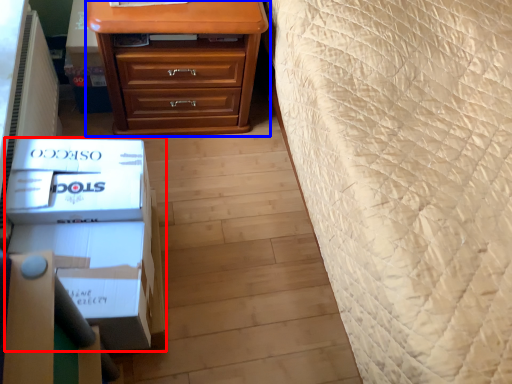
Question: Which point is closer to the camera, box (highlighted by a red box) or chest of drawers (highlighted by a blue box)?

Choices:
 (A) box
 (B) chest of drawers

Answer: (A)